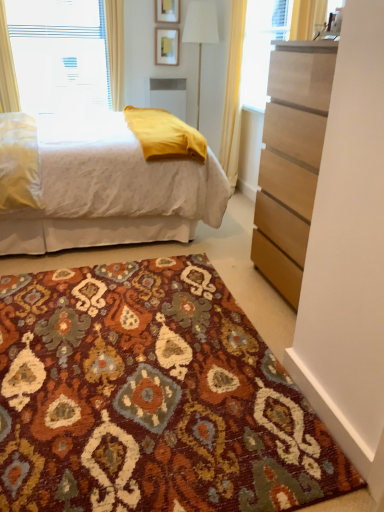
I want to click on free point above multicolored woven rug at center (from a real-world perspective), so click(x=168, y=317).